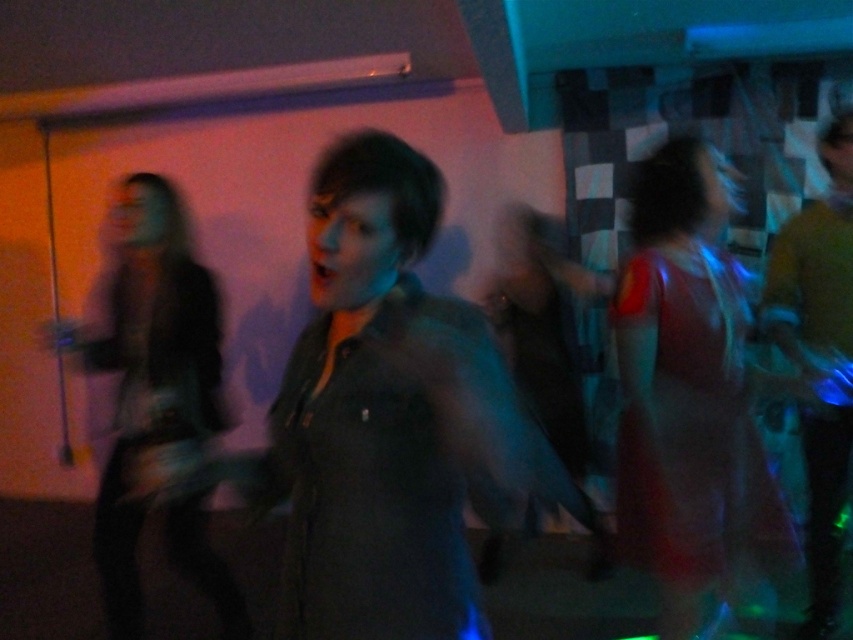
You are organizing a closet and need to hang the shiny red dress at right and the dark gray fabric jacket at left. Which item requires a narrower hanger?

The shiny red dress at right requires a narrower hanger because it is thinner than the dark gray fabric jacket at left.

You are at a party and see the dark gray shirt at center and the shiny red dress at right. Which one is positioned lower in the image?

The dark gray shirt at center is below the shiny red dress at right, so it is positioned lower in the image.